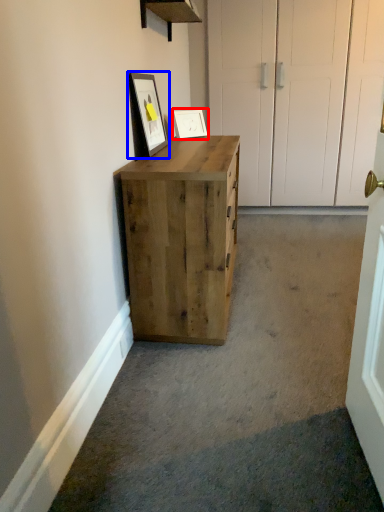
Question: Which point is closer to the camera, picture frame (highlighted by a red box) or picture frame (highlighted by a blue box)?

Choices:
 (A) picture frame
 (B) picture frame

Answer: (B)